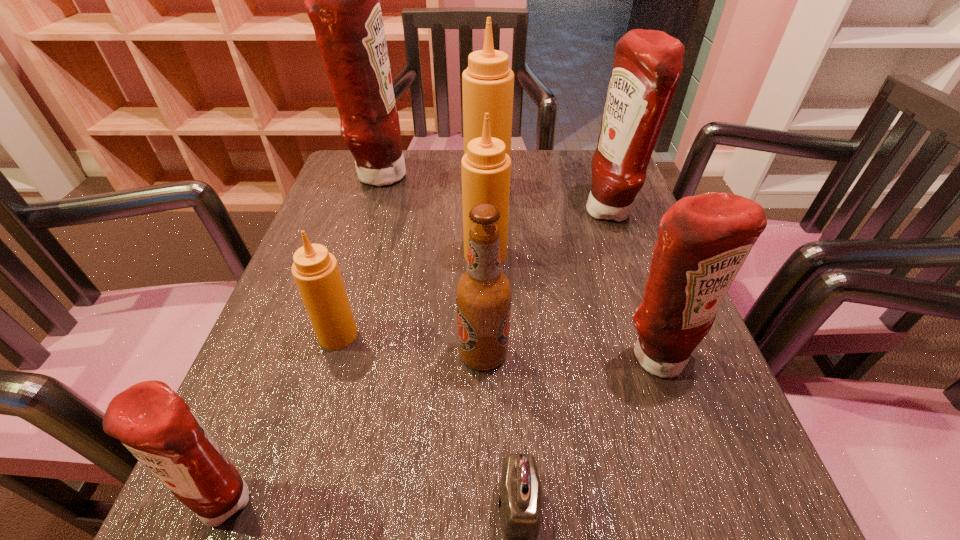
Locate an element on the screen. Image resolution: width=960 pixels, height=540 pixels. the nearest condiment is located at coordinates (156, 425).

Locate an element on the screen. The image size is (960, 540). the smallest red condiment is located at coordinates [x=156, y=425].

Where is `vacant space located 0.260m on the front of the biggest red condiment`? Image resolution: width=960 pixels, height=540 pixels. vacant space located 0.260m on the front of the biggest red condiment is located at coordinates (349, 271).

Locate an element on the screen. The width and height of the screenshot is (960, 540). blank space located on the front of the biggest tan condiment is located at coordinates (489, 293).

Find the location of `vacant space situated 0.100m on the front of the second biggest red condiment`. vacant space situated 0.100m on the front of the second biggest red condiment is located at coordinates (628, 265).

Find the location of `vacant position located on the back of the third farthest red condiment`. vacant position located on the back of the third farthest red condiment is located at coordinates (636, 294).

Identify the location of free space located 0.170m on the right of the sixth nearest object. Image resolution: width=960 pixels, height=540 pixels. (589, 255).

What are the coordinates of `blank space located on the front label of the beer bottle` in the screenshot? It's located at (276, 354).

At what (x,y) coordinates should I click in order to perform the action: click on free spot located on the front label of the beer bottle. Please return your answer as a coordinate pair (x, y). The height and width of the screenshot is (540, 960). Looking at the image, I should click on (312, 354).

In order to click on vacant space located on the front label of the beer bottle in this screenshot , I will do `click(379, 354)`.